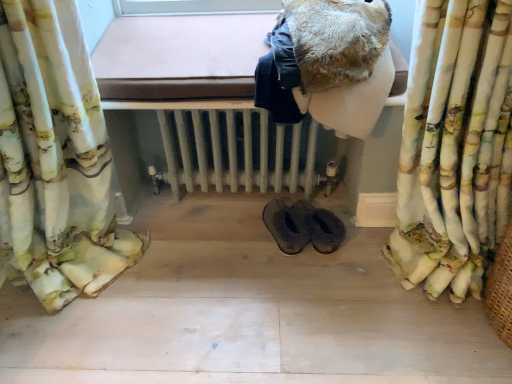
Find the location of `blank space to the left of black leather slippers at center`. blank space to the left of black leather slippers at center is located at coordinates (232, 261).